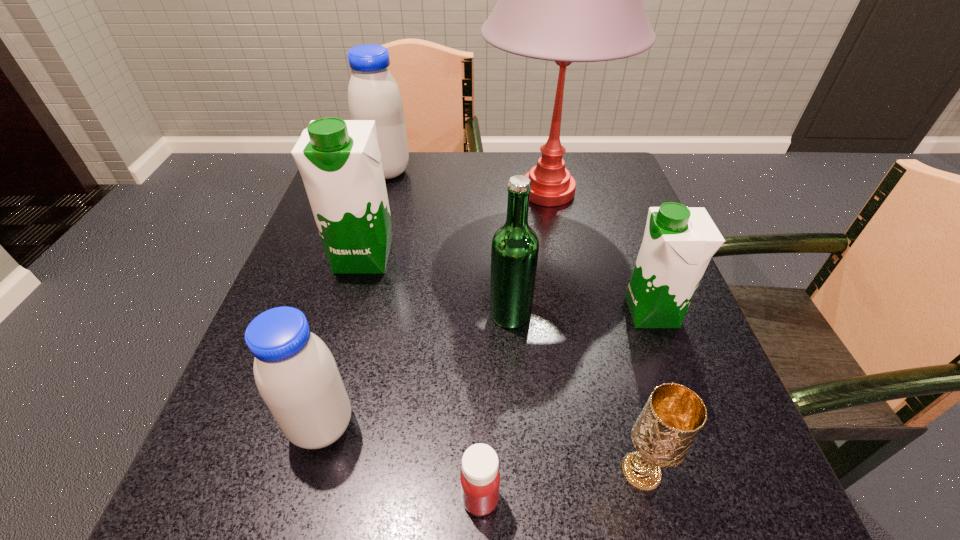
You are a GUI agent. You are given a task and a screenshot of the screen. Output one action in this format:
    pyautogui.click(x=<x>, y=<y>)
    Task: Click on the free point that satisfies the following two spatial constraints: 1. on the back side of the beer bottle; 2. on the left side of the nearer blue soya milk
    This screenshot has height=540, width=960.
    Given the screenshot: What is the action you would take?
    pyautogui.click(x=353, y=314)

Locate an element on the screen. The width and height of the screenshot is (960, 540). free region that satisfies the following two spatial constraints: 1. on the front-facing side of the left green soya milk; 2. on the right side of the nearer blue soya milk is located at coordinates (316, 426).

Locate an element on the screen. vacant space that satisfies the following two spatial constraints: 1. on the front-facing side of the second shortest object; 2. on the right side of the tallest object is located at coordinates (603, 472).

Where is `free space that satisfies the following two spatial constraints: 1. on the front side of the farther blue soya milk; 2. on the left side of the red medicine`? free space that satisfies the following two spatial constraints: 1. on the front side of the farther blue soya milk; 2. on the left side of the red medicine is located at coordinates (292, 498).